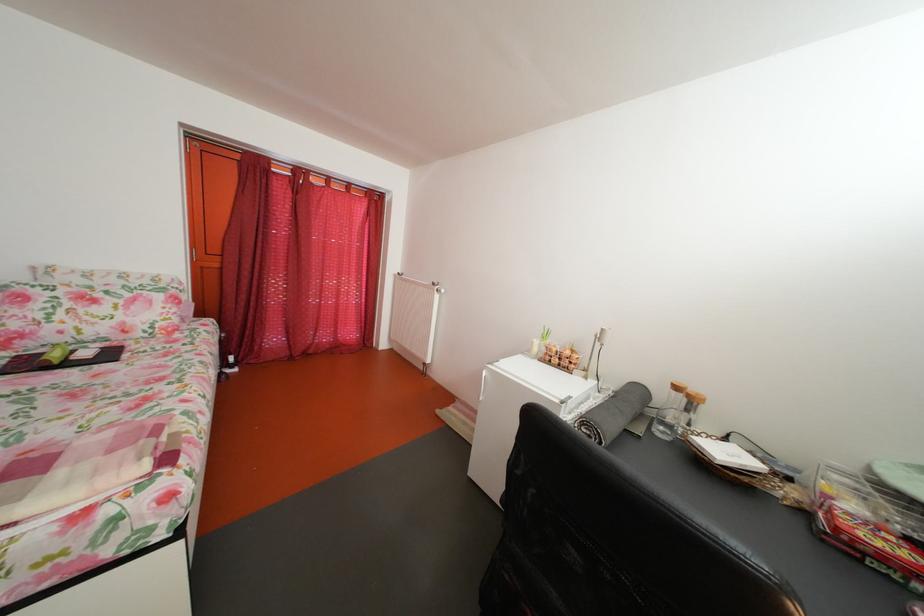
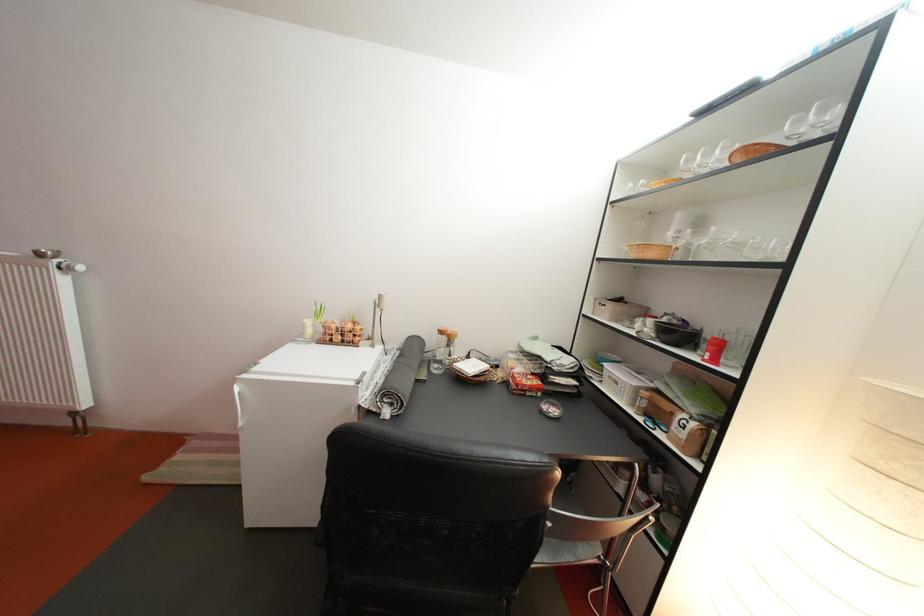
Find the pixel in the second image that matches point 687,394 in the first image.

(453, 339)